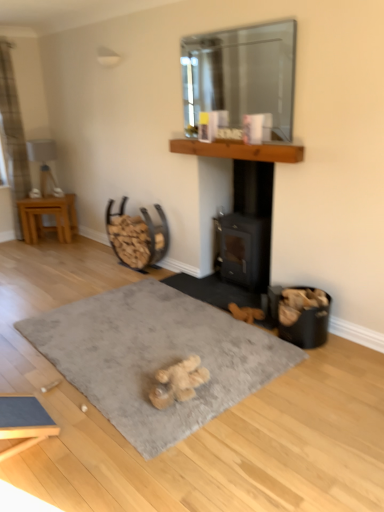
Locate an element on the screen. The image size is (384, 512). vacant location below brown wooden mantle at upper center (from a real-world perspective) is located at coordinates (232, 287).